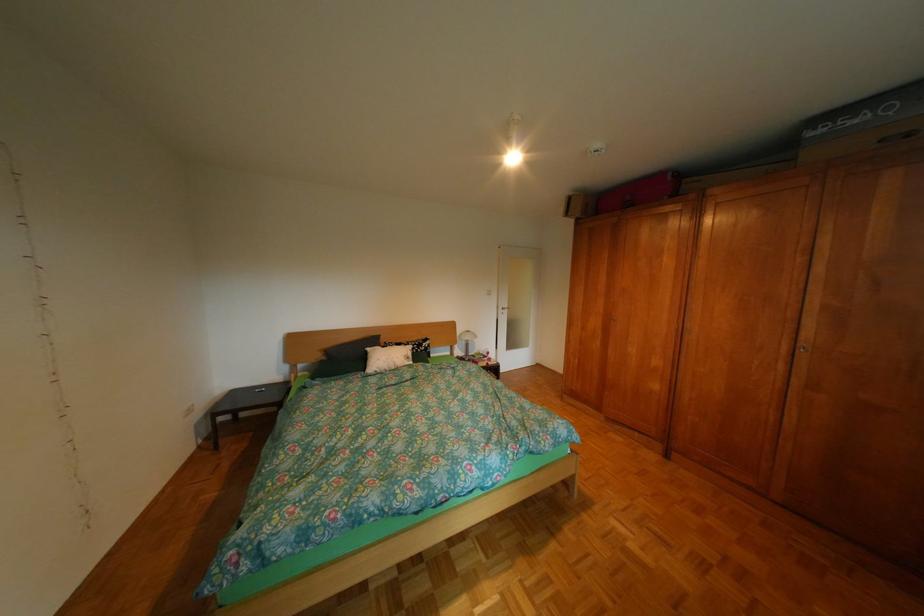
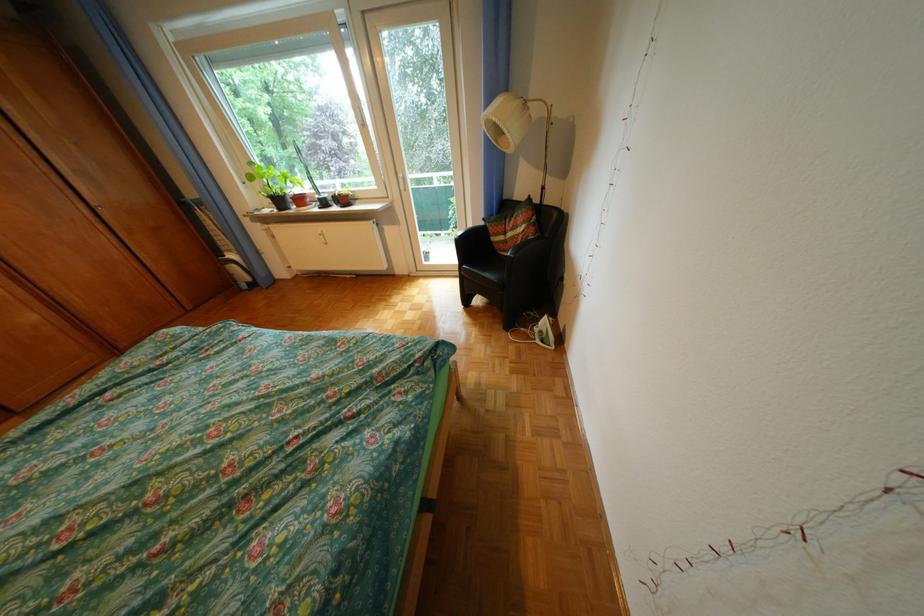
The point at (817, 345) is marked in the first image. Where is the corresponding point in the second image?

(110, 205)